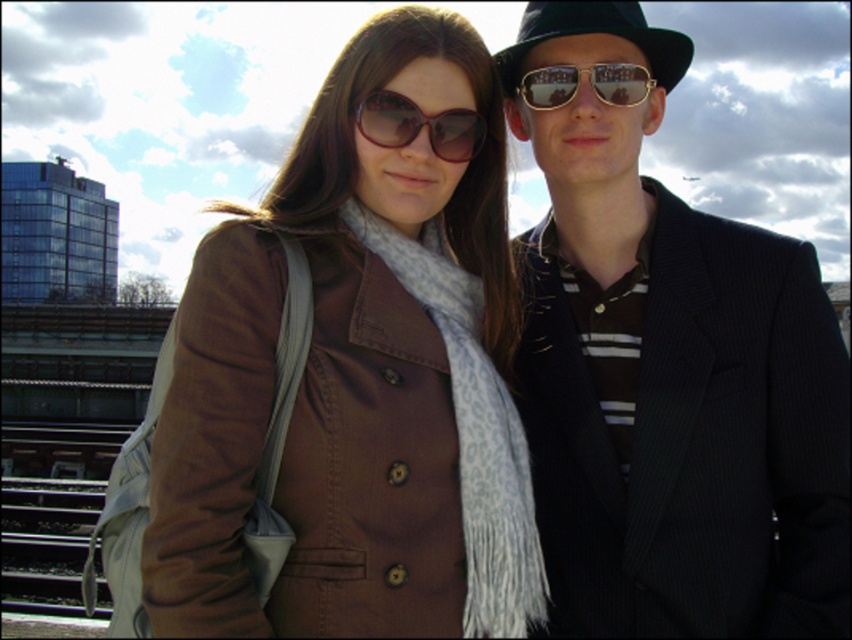
Is point (383, 138) positioned behind point (566, 83)?

No, (383, 138) is in front of (566, 83).

Is sunglasses at center below gold reflective sunglasses at center?

Yes, sunglasses at center is below gold reflective sunglasses at center.

The image size is (852, 640). In order to click on sunglasses at center in this screenshot , I will do `click(419, 125)`.

Where is `sunglasses at center`? sunglasses at center is located at coordinates coord(419,125).

Who is higher up, shiny black suit at center or black felt fedora at upper center?

black felt fedora at upper center is above.

Between shiny black suit at center and black felt fedora at upper center, which one appears on the right side from the viewer's perspective?

From the viewer's perspective, shiny black suit at center appears more on the right side.

Where is `shiny black suit at center`? This screenshot has width=852, height=640. shiny black suit at center is located at coordinates (669, 374).

The width and height of the screenshot is (852, 640). I want to click on shiny black suit at center, so 669,374.

Who is positioned more to the left, black felt fedora at upper center or gold reflective sunglasses at center?

Positioned to the left is gold reflective sunglasses at center.

Measure the distance between black felt fedora at upper center and gold reflective sunglasses at center.

black felt fedora at upper center and gold reflective sunglasses at center are 89.21 centimeters apart from each other.

Measure the distance between black felt fedora at upper center and camera.

The distance of black felt fedora at upper center from camera is 10.88 meters.

In order to click on black felt fedora at upper center in this screenshot , I will do 596,33.